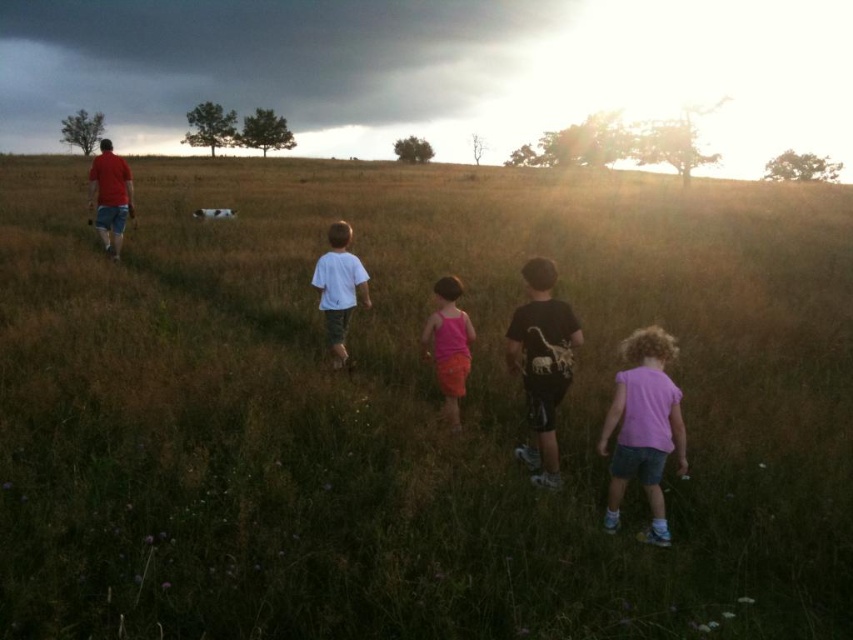
You are standing in the serene outdoor scene and want to determine which of the two points, point (550, 376) or point (346, 355), is closer to you. Based on the scene description, which point is nearer?

Point (550, 376) is closer to the camera than point (346, 355).

Looking at this image, you are a photographer trying to capture a group photo of the pink fabric shirt at lower right and the white cotton shirt at center. The camera can only focus on objects within a 2 meter width. Can both fit in the frame if they stand side by side?

The pink fabric shirt at lower right might be wider than white cotton shirt at center, so the total width could exceed 2 meters. It is uncertain if both can fit in the frame.